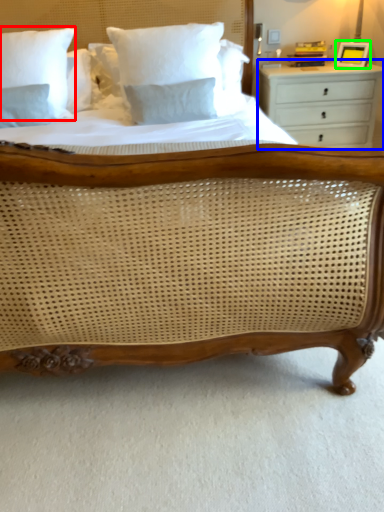
Question: Estimate the real-world distances between objects in this image. Which object is farther from pillow (highlighted by a red box), chest of drawers (highlighted by a blue box) or picture frame (highlighted by a green box)?

Choices:
 (A) chest of drawers
 (B) picture frame

Answer: (B)